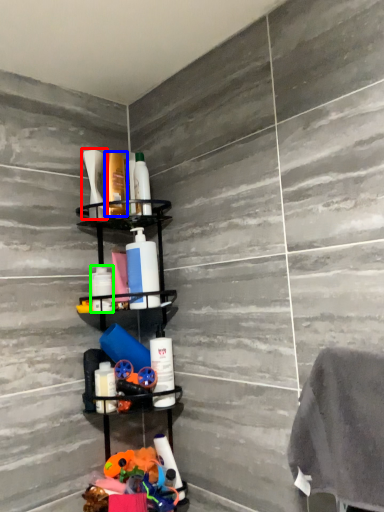
Question: Considering the real-world distances, which object is farthest from toiletry (highlighted by a red box)? toiletry (highlighted by a blue box) or toiletry (highlighted by a green box)?

Choices:
 (A) toiletry
 (B) toiletry

Answer: (B)